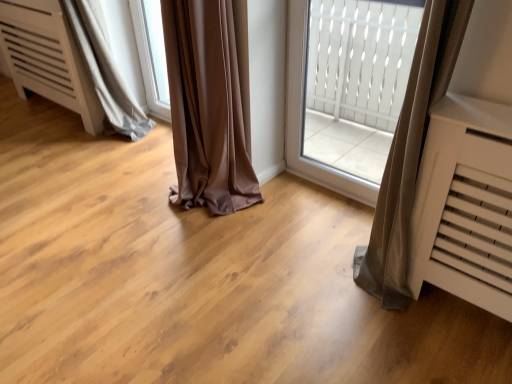
Question: Considering the positions of point (372, 77) and point (159, 46), is point (372, 77) closer or farther from the camera than point (159, 46)?

Choices:
 (A) farther
 (B) closer

Answer: (A)

Question: Is white textured glass at center to the left or to the right of transparent glass window at center in the image?

Choices:
 (A) left
 (B) right

Answer: (B)

Question: Considering the real-world distances, which object is closest to the transparent glass window at center?

Choices:
 (A) white textured glass at center
 (B) gray satin curtain at lower left

Answer: (B)

Question: Which object is positioned farthest from the transparent glass window at center?

Choices:
 (A) gray satin curtain at lower left
 (B) white textured glass at center

Answer: (B)